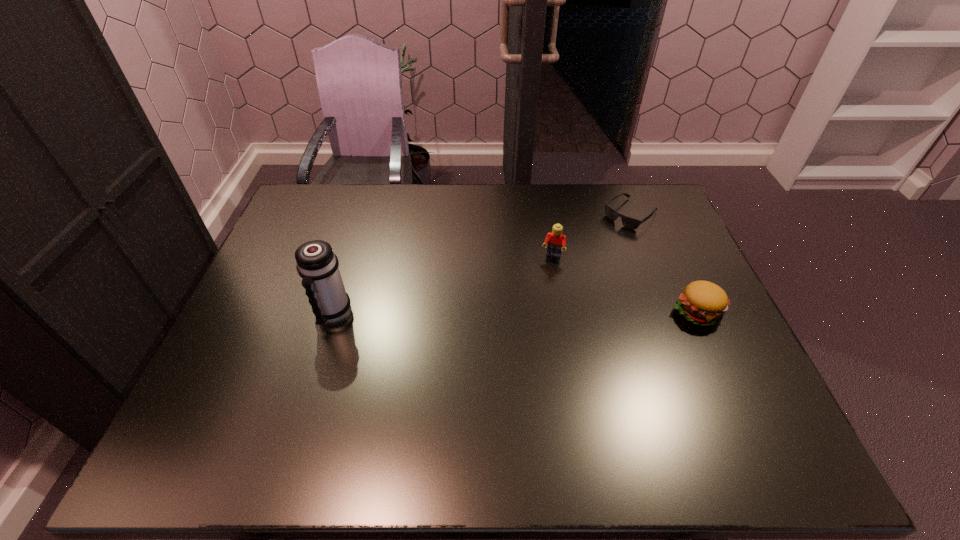
The width and height of the screenshot is (960, 540). In order to click on free location at the near edge of the desktop in this screenshot , I will do `click(527, 392)`.

Find the location of a particular element. vacant space at the left edge of the desktop is located at coordinates (223, 350).

The width and height of the screenshot is (960, 540). I want to click on free spot at the right edge of the desktop, so click(669, 326).

This screenshot has height=540, width=960. I want to click on free space at the far left corner of the desktop, so click(319, 225).

Locate an element on the screen. Image resolution: width=960 pixels, height=540 pixels. vacant space at the far right corner of the desktop is located at coordinates (632, 186).

At what (x,y) coordinates should I click in order to perform the action: click on vacant space that's between the second shortest object and the Lego. Please return your answer as a coordinate pair (x, y). This screenshot has width=960, height=540. Looking at the image, I should click on (625, 284).

Identify the location of free area in between the third tallest object and the leftmost object. The width and height of the screenshot is (960, 540). (516, 313).

Locate an element on the screen. Image resolution: width=960 pixels, height=540 pixels. free space between the second shortest object and the farthest object is located at coordinates (663, 262).

Locate an element on the screen. The width and height of the screenshot is (960, 540). free spot between the tallest object and the third shortest object is located at coordinates (443, 286).

In order to click on vacant region between the second shortest object and the third object from right to left in this screenshot , I will do tap(625, 284).